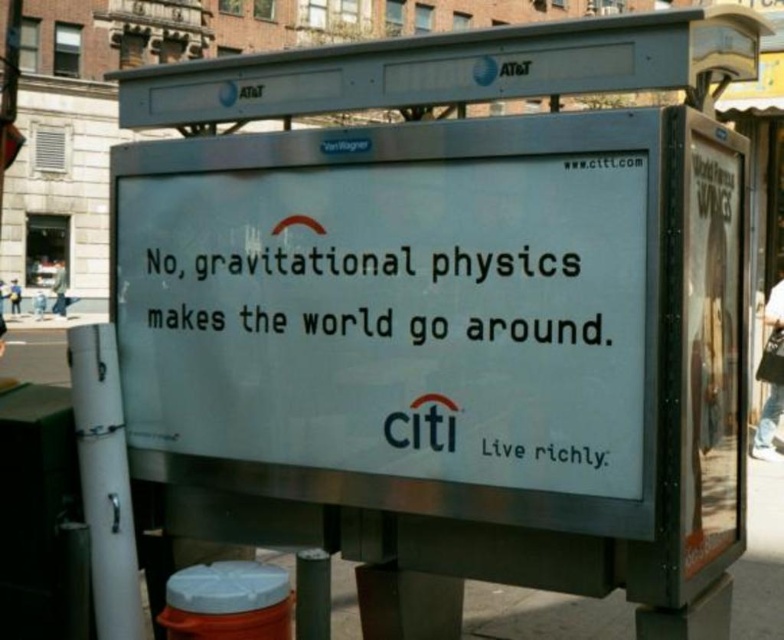
Which is in front, point (296, 76) or point (505, 595)?

Point (296, 76) is in front.

Locate an element on the screen. This screenshot has height=640, width=784. metallic silver street sign at upper center is located at coordinates (414, 72).

Does metallic silver street sign at upper center have a lesser width compared to black text at center?

In fact, metallic silver street sign at upper center might be wider than black text at center.

Based on the photo, who is taller, metallic silver street sign at upper center or black text at center?

Standing taller between the two is metallic silver street sign at upper center.

Which is in front, point (487, 72) or point (267, 307)?

Point (487, 72)

Identify the location of metallic silver street sign at upper center. The height and width of the screenshot is (640, 784). (414, 72).

Based on the photo, is black text at center wider than gray concrete pavement at lower center?

Incorrect, black text at center's width does not surpass gray concrete pavement at lower center's.

Between black text at center and gray concrete pavement at lower center, which one is positioned higher?

black text at center

Identify the location of black text at center. (394, 289).